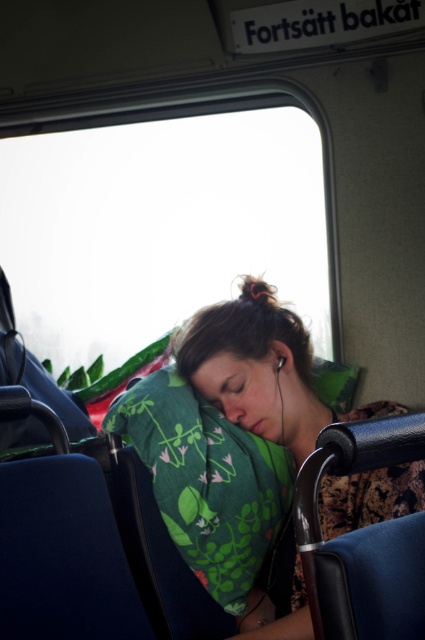
You are a passenger sitting in the train and want to look outside through the transparent glass window at upper center. However, you are currently resting on the green floral pillow at center. Can you see the window without moving your head?

The transparent glass window at upper center is above the green floral pillow at center, so you can see the window without moving your head because it is positioned above you while resting on the pillow.

You are a passenger on a train and want to know if you can place your 20 cm wide book on the transparent glass window at upper center or the green floral pillow at center. Which surface can accommodate your book?

The transparent glass window at upper center has a larger width than the green floral pillow at center, so the book can fit on the transparent glass window at upper center.